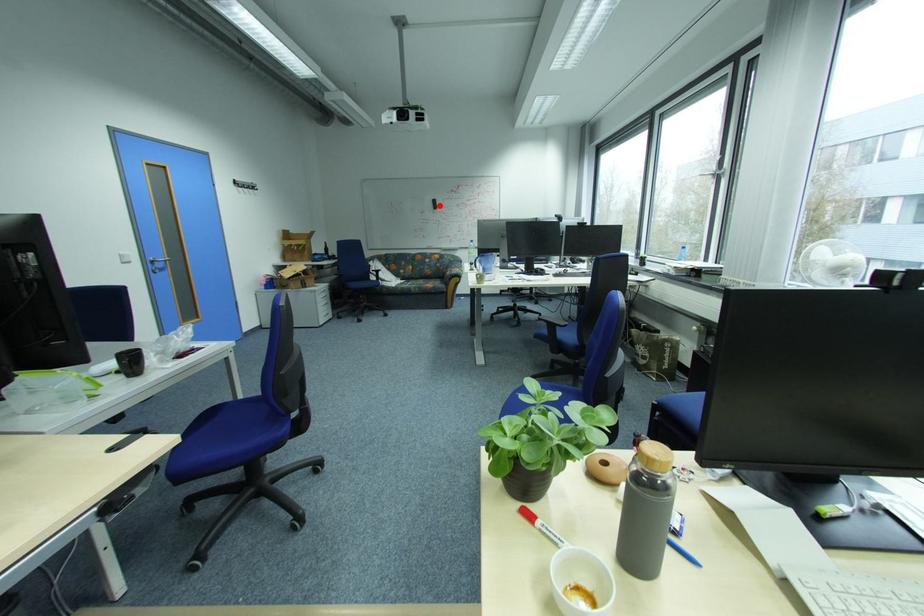
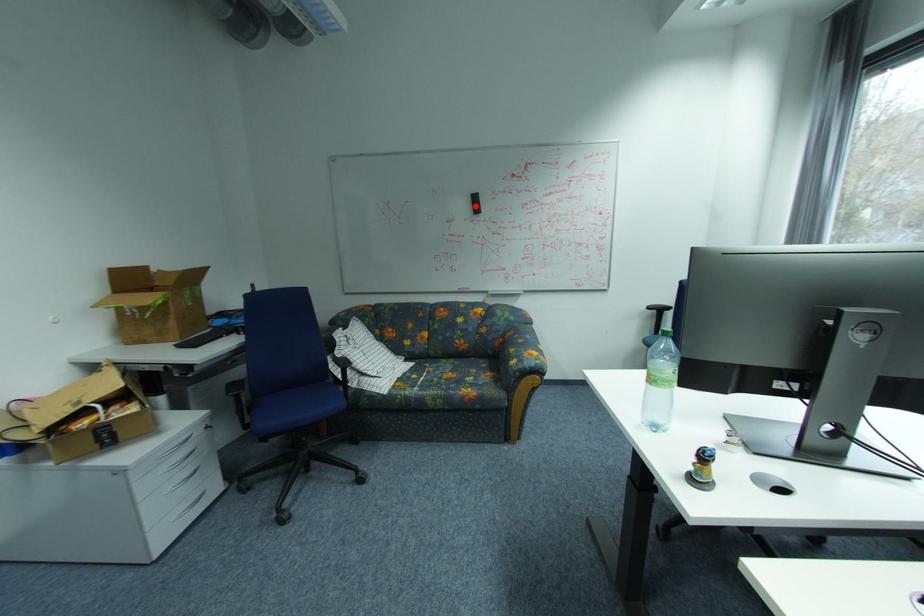
I am providing you with two images of the same scene from different viewpoints. A red point is marked on the first image and another point is marked on the second image. Are the points marked in image1 and image2 representing the same 3D position?

Yes